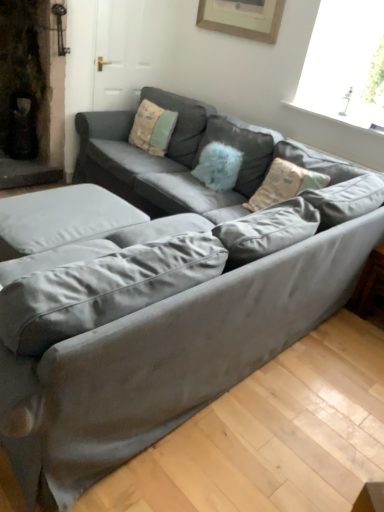
Question: Is satin gray couch at center thinner than wooden picture frame at upper center?

Choices:
 (A) no
 (B) yes

Answer: (A)

Question: Is the position of satin gray couch at center more distant than that of wooden picture frame at upper center?

Choices:
 (A) no
 (B) yes

Answer: (A)

Question: Is satin gray couch at center wider than wooden picture frame at upper center?

Choices:
 (A) no
 (B) yes

Answer: (B)

Question: Considering the relative sizes of satin gray couch at center and wooden picture frame at upper center in the image provided, is satin gray couch at center shorter than wooden picture frame at upper center?

Choices:
 (A) no
 (B) yes

Answer: (A)

Question: From a real-world perspective, is satin gray couch at center located beneath wooden picture frame at upper center?

Choices:
 (A) yes
 (B) no

Answer: (A)

Question: Is the surface of satin gray couch at center in direct contact with wooden picture frame at upper center?

Choices:
 (A) no
 (B) yes

Answer: (A)

Question: Is satin gray couch at center thinner than wooden side table at lower right?

Choices:
 (A) no
 (B) yes

Answer: (A)

Question: Is wooden side table at lower right inside satin gray couch at center?

Choices:
 (A) no
 (B) yes

Answer: (A)

Question: Is satin gray couch at center touching wooden side table at lower right?

Choices:
 (A) no
 (B) yes

Answer: (A)

Question: From the image's perspective, does satin gray couch at center appear lower than wooden side table at lower right?

Choices:
 (A) no
 (B) yes

Answer: (A)

Question: Can we say satin gray couch at center lies outside wooden side table at lower right?

Choices:
 (A) yes
 (B) no

Answer: (A)

Question: From the image's perspective, would you say satin gray couch at center is positioned over wooden side table at lower right?

Choices:
 (A) yes
 (B) no

Answer: (A)

Question: Is satin gray couch at center oriented away from velvet beige pillow at center, which is counted as the 1th pillow, starting from the left?

Choices:
 (A) no
 (B) yes

Answer: (B)